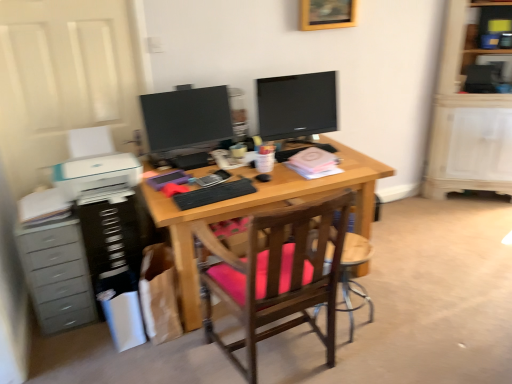
This screenshot has height=384, width=512. I want to click on free space underneath wooden chair at center (from a real-world perspective), so click(x=355, y=331).